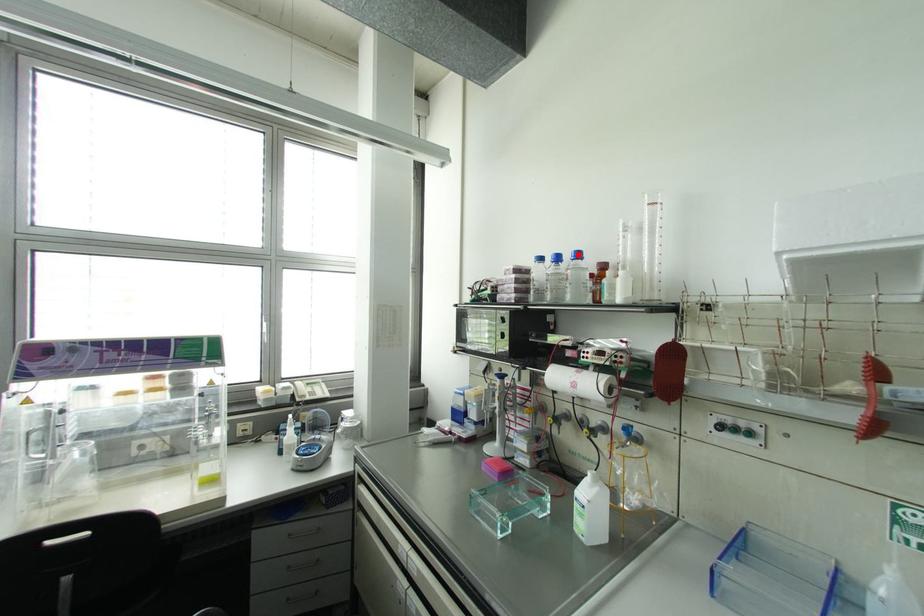
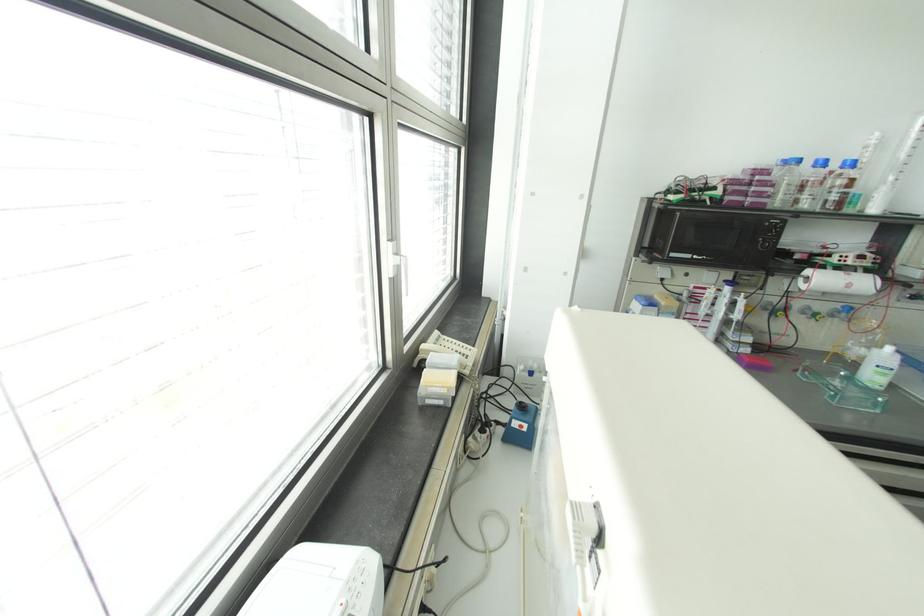
The point at the highlighted location is marked in the first image. Where is the corresponding point in the second image?

(852, 163)